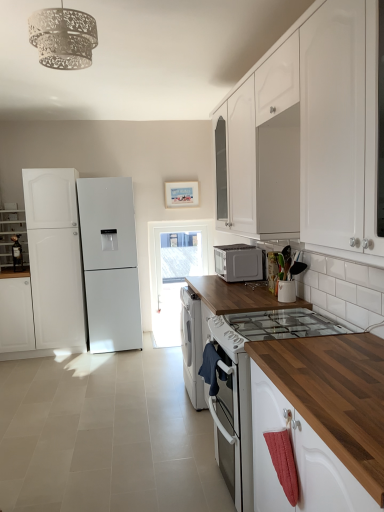
Question: From a real-world perspective, is white matte cabinet at left, marked as the 1th cabinetry in a left-to-right arrangement, located beneath satin silver microwave at center?

Choices:
 (A) no
 (B) yes

Answer: (B)

Question: From the image's perspective, does white matte cabinet at left, marked as the 1th cabinetry in a left-to-right arrangement, appear higher than satin silver microwave at center?

Choices:
 (A) no
 (B) yes

Answer: (A)

Question: Does white matte cabinet at left, marked as the 1th cabinetry in a left-to-right arrangement, have a greater width compared to satin silver microwave at center?

Choices:
 (A) yes
 (B) no

Answer: (A)

Question: Are white matte cabinet at left, marked as the 1th cabinetry in a left-to-right arrangement, and satin silver microwave at center far apart?

Choices:
 (A) no
 (B) yes

Answer: (B)

Question: Is white matte cabinet at left, marked as the 1th cabinetry in a left-to-right arrangement, at the left side of satin silver microwave at center?

Choices:
 (A) no
 (B) yes

Answer: (B)

Question: Can you confirm if white matte cabinet at left, placed as the third cabinetry when sorted from front to back, is taller than satin silver microwave at center?

Choices:
 (A) yes
 (B) no

Answer: (A)

Question: Is wooden at center facing towards matte white cabinet at left, acting as the third cabinetry starting from the right?

Choices:
 (A) no
 (B) yes

Answer: (A)

Question: From a real-world perspective, is wooden at center physically above matte white cabinet at left, placed as the 4th cabinetry when sorted from front to back?

Choices:
 (A) no
 (B) yes

Answer: (A)

Question: Can you confirm if wooden at center is shorter than matte white cabinet at left, acting as the third cabinetry starting from the right?

Choices:
 (A) no
 (B) yes

Answer: (A)

Question: From the image's perspective, does wooden at center appear lower than matte white cabinet at left, acting as the third cabinetry starting from the right?

Choices:
 (A) no
 (B) yes

Answer: (B)

Question: From the image's perspective, would you say wooden at center is positioned over matte white cabinet at left, the 1th cabinetry in the back-to-front sequence?

Choices:
 (A) yes
 (B) no

Answer: (B)

Question: Is wooden at center wider than matte white cabinet at left, placed as the 4th cabinetry when sorted from front to back?

Choices:
 (A) yes
 (B) no

Answer: (A)

Question: From a real-world perspective, is white matte cabinet at upper center, which is counted as the 3th cabinetry, starting from the back, physically below white matte refrigerator at left?

Choices:
 (A) yes
 (B) no

Answer: (B)